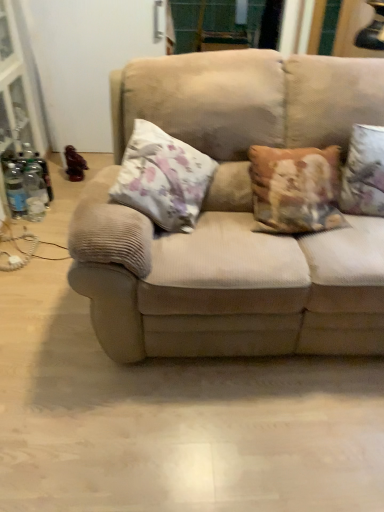
The width and height of the screenshot is (384, 512). Describe the element at coordinates (232, 217) in the screenshot. I see `beige corduroy couch at center` at that location.

Measure the distance between point (211, 168) and camera.

A distance of 5.93 feet exists between point (211, 168) and camera.

In order to click on floral fabric pillow at right, acting as the 2th pillow starting from the left in this screenshot , I will do tap(364, 172).

Considering the positions of objects floral fabric pillow at center, the first pillow in the left-to-right sequence, and wooden statue at left in the image provided, who is more to the right, floral fabric pillow at center, the first pillow in the left-to-right sequence, or wooden statue at left?

From the viewer's perspective, floral fabric pillow at center, the first pillow in the left-to-right sequence, appears more on the right side.

Are floral fabric pillow at center, arranged as the second pillow when viewed from the right, and wooden statue at left making contact?

They are not placed beside each other.

Looking at this image, is floral fabric pillow at center, the first pillow in the left-to-right sequence, wider than wooden statue at left?

Indeed, floral fabric pillow at center, the first pillow in the left-to-right sequence, has a greater width compared to wooden statue at left.

Consider the image. Which object is positioned more to the left, beige corduroy couch at center or floral fabric pillow at center, arranged as the second pillow when viewed from the right?

From the viewer's perspective, floral fabric pillow at center, arranged as the second pillow when viewed from the right, appears more on the left side.

Is beige corduroy couch at center taller than floral fabric pillow at center, the first pillow in the left-to-right sequence?

Correct, beige corduroy couch at center is much taller as floral fabric pillow at center, the first pillow in the left-to-right sequence.

From the image's perspective, relative to floral fabric pillow at center, arranged as the second pillow when viewed from the right, is beige corduroy couch at center above or below?

Based on their image positions, beige corduroy couch at center is located beneath floral fabric pillow at center, arranged as the second pillow when viewed from the right.

Is beige corduroy couch at center inside or outside of floral fabric pillow at center, arranged as the second pillow when viewed from the right?

beige corduroy couch at center is not inside floral fabric pillow at center, arranged as the second pillow when viewed from the right, it's outside.

At what (x,y) coordinates should I click in order to perform the action: click on toy located on the left of floral fabric pillow at right, which appears as the 1th pillow when viewed from the right. Please return your answer as a coordinate pair (x, y). This screenshot has width=384, height=512. Looking at the image, I should click on (74, 164).

Is there a large distance between wooden statue at left and floral fabric pillow at right, which appears as the 1th pillow when viewed from the right?

Yes, wooden statue at left and floral fabric pillow at right, which appears as the 1th pillow when viewed from the right, are located far from each other.

Could you measure the distance between wooden statue at left and floral fabric pillow at right, acting as the 2th pillow starting from the left?

A distance of 2.03 meters exists between wooden statue at left and floral fabric pillow at right, acting as the 2th pillow starting from the left.

Which is in front, point (82, 160) or point (364, 211)?

Point (364, 211)

Who is taller, beige corduroy couch at center or wooden statue at left?

With more height is beige corduroy couch at center.

Could wooden statue at left be considered to be inside beige corduroy couch at center?

Definitely not — wooden statue at left is not inside beige corduroy couch at center.

Between beige corduroy couch at center and wooden statue at left, which one has smaller size?

With smaller size is wooden statue at left.

Between wooden statue at left and beige corduroy couch at center, which one has larger width?

beige corduroy couch at center.

Does wooden statue at left have a smaller size compared to beige corduroy couch at center?

Correct, wooden statue at left occupies less space than beige corduroy couch at center.

Could you tell me if wooden statue at left is facing beige corduroy couch at center?

No, wooden statue at left is not facing towards beige corduroy couch at center.

Is floral fabric pillow at center, arranged as the second pillow when viewed from the right, completely or partially inside wooden statue at left?

No, floral fabric pillow at center, arranged as the second pillow when viewed from the right, is not inside wooden statue at left.

Does wooden statue at left have a lesser width compared to floral fabric pillow at center, arranged as the second pillow when viewed from the right?

Yes, wooden statue at left is thinner than floral fabric pillow at center, arranged as the second pillow when viewed from the right.

Can you tell me how much wooden statue at left and floral fabric pillow at center, arranged as the second pillow when viewed from the right, differ in facing direction?

111 degrees separate the facing orientations of wooden statue at left and floral fabric pillow at center, arranged as the second pillow when viewed from the right.

Can you confirm if wooden statue at left is shorter than floral fabric pillow at center, arranged as the second pillow when viewed from the right?

Correct, wooden statue at left is not as tall as floral fabric pillow at center, arranged as the second pillow when viewed from the right.

Between beige corduroy couch at center and floral fabric pillow at right, acting as the 2th pillow starting from the left, which one appears on the left side from the viewer's perspective?

Positioned to the left is beige corduroy couch at center.

Is beige corduroy couch at center oriented away from floral fabric pillow at right, acting as the 2th pillow starting from the left?

Yes.

Who is smaller, beige corduroy couch at center or floral fabric pillow at right, which appears as the 1th pillow when viewed from the right?

floral fabric pillow at right, which appears as the 1th pillow when viewed from the right.

From a real-world perspective, is beige corduroy couch at center positioned over floral fabric pillow at right, acting as the 2th pillow starting from the left, based on gravity?

No.

Identify the location of toy below the floral fabric pillow at center, the first pillow in the left-to-right sequence (from a real-world perspective). (74, 164).

Image resolution: width=384 pixels, height=512 pixels. Identify the location of studio couch in front of the floral fabric pillow at center, the first pillow in the left-to-right sequence. [x=232, y=217].

From the image, which object appears to be farther from floral fabric pillow at right, acting as the 2th pillow starting from the left, beige corduroy couch at center or wooden statue at left?

wooden statue at left is further to floral fabric pillow at right, acting as the 2th pillow starting from the left.

Based on their spatial positions, is floral fabric pillow at right, which appears as the 1th pillow when viewed from the right, or beige corduroy couch at center closer to wooden statue at left?

Based on the image, beige corduroy couch at center appears to be nearer to wooden statue at left.

Looking at the image, which one is located further to floral fabric pillow at right, acting as the 2th pillow starting from the left, floral fabric pillow at center, the first pillow in the left-to-right sequence, or beige corduroy couch at center?

The object further to floral fabric pillow at right, acting as the 2th pillow starting from the left, is floral fabric pillow at center, the first pillow in the left-to-right sequence.

Which object lies further to the anchor point beige corduroy couch at center, floral fabric pillow at center, the first pillow in the left-to-right sequence, or wooden statue at left?

wooden statue at left is positioned further to the anchor beige corduroy couch at center.

Based on their spatial positions, is beige corduroy couch at center or wooden statue at left further from floral fabric pillow at center, arranged as the second pillow when viewed from the right?

The object further to floral fabric pillow at center, arranged as the second pillow when viewed from the right, is wooden statue at left.

Looking at the image, which one is located closer to floral fabric pillow at right, which appears as the 1th pillow when viewed from the right, floral fabric pillow at center, the first pillow in the left-to-right sequence, or wooden statue at left?

The object closer to floral fabric pillow at right, which appears as the 1th pillow when viewed from the right, is floral fabric pillow at center, the first pillow in the left-to-right sequence.

Which object lies nearer to the anchor point wooden statue at left, floral fabric pillow at center, the first pillow in the left-to-right sequence, or beige corduroy couch at center?

floral fabric pillow at center, the first pillow in the left-to-right sequence, is positioned closer to the anchor wooden statue at left.

In the scene shown: Considering their positions, is wooden statue at left positioned closer to floral fabric pillow at right, acting as the 2th pillow starting from the left, than beige corduroy couch at center?

Among the two, beige corduroy couch at center is located nearer to floral fabric pillow at right, acting as the 2th pillow starting from the left.

The image size is (384, 512). I want to click on studio couch between floral fabric pillow at center, the first pillow in the left-to-right sequence, and floral fabric pillow at right, acting as the 2th pillow starting from the left, in the horizontal direction, so click(x=232, y=217).

The image size is (384, 512). In order to click on pillow between floral fabric pillow at center, the first pillow in the left-to-right sequence, and wooden statue at left from front to back in this screenshot , I will do `click(364, 172)`.